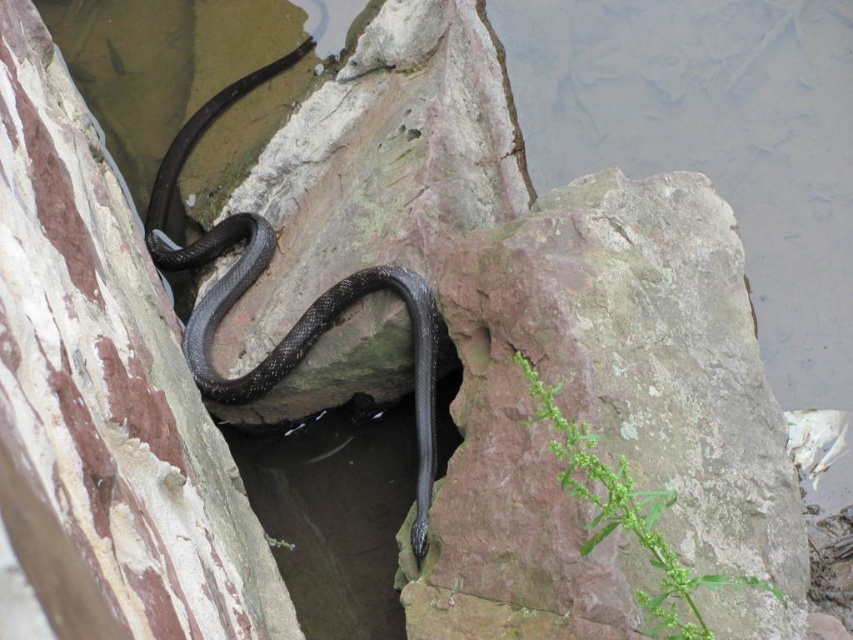
Which is behind, point (572, 365) or point (389, 289)?

The point (389, 289) is behind.

Is rusty stone at center to the left of shiny black snake at center from the viewer's perspective?

In fact, rusty stone at center is to the right of shiny black snake at center.

Is point (497, 420) in front of point (433, 468)?

That is True.

Locate an element on the screen. Image resolution: width=853 pixels, height=640 pixels. rusty stone at center is located at coordinates (608, 420).